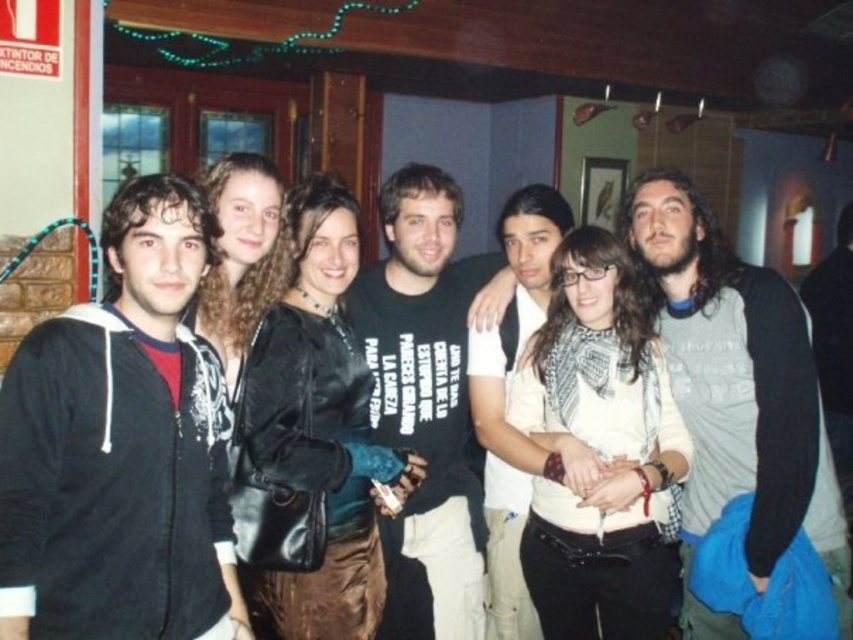
You are taking a photo of the group and want to focus on both the point at position (810, 360) and the point at position (381, 230). Which point should you adjust your focus to first if you want to ensure both are in focus?

You should focus on point (381, 230) first because it is farther from the camera than point (810, 360), so adjusting focus starting from the farther point will help ensure both are in focus.